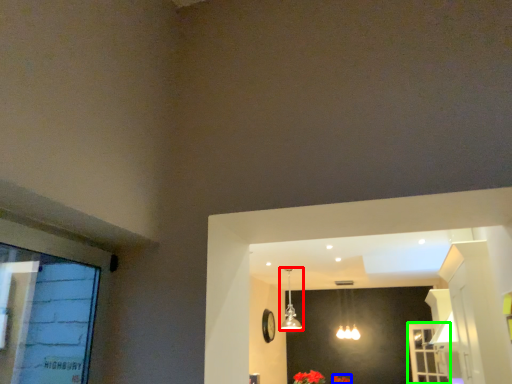
Question: Based on their relative distances, which object is farther from lamp (highlighted by a red box)? Choose from flower (highlighted by a blue box) and screen door (highlighted by a green box).

Choices:
 (A) flower
 (B) screen door

Answer: (B)